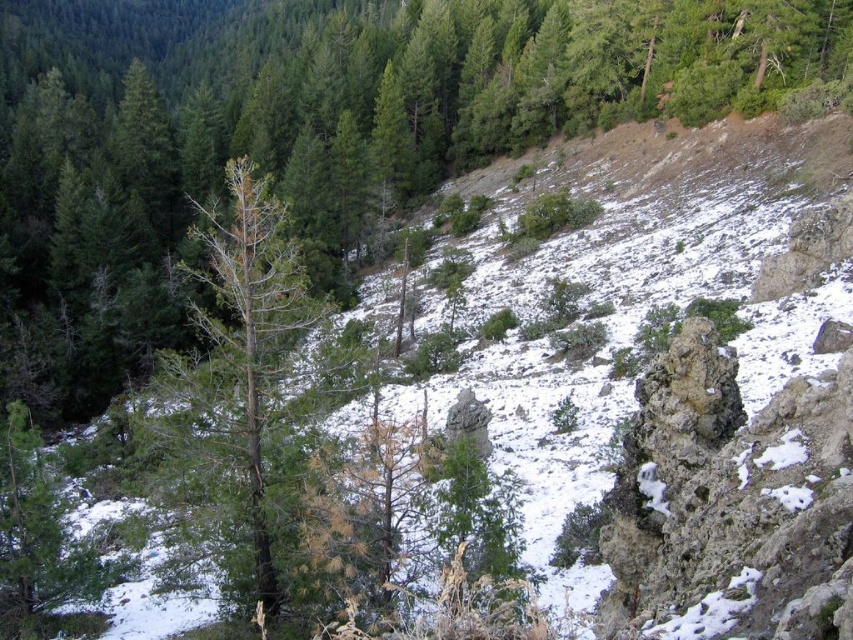
From the picture: Which is above, green matte tree at center or brown/dried wood tree at left?

Positioned higher is green matte tree at center.

The image size is (853, 640). In order to click on green matte tree at center in this screenshot , I will do `click(317, 136)`.

Does point (276, 36) lie behind point (225, 461)?

That is True.

Identify the location of green matte tree at center. The height and width of the screenshot is (640, 853). (317, 136).